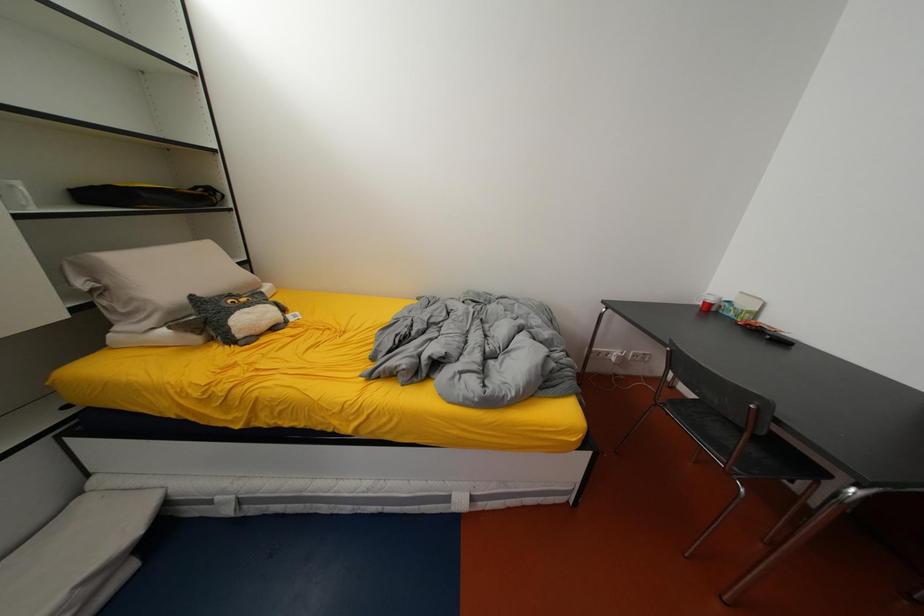
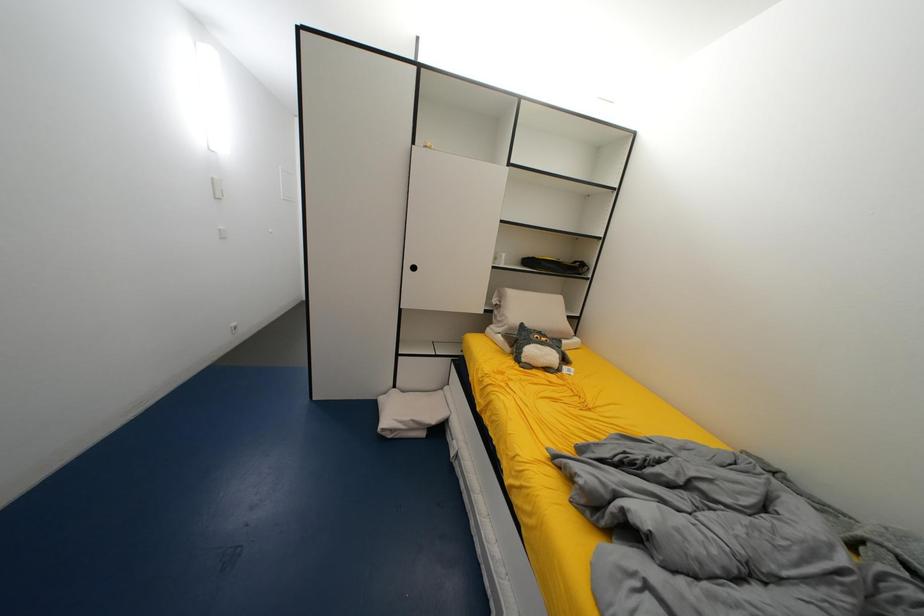
Question: The images are taken continuously from a first-person perspective. In which direction is your viewpoint rotating?

Choices:
 (A) Left
 (B) Right
 (C) Up
 (D) Down

Answer: (A)